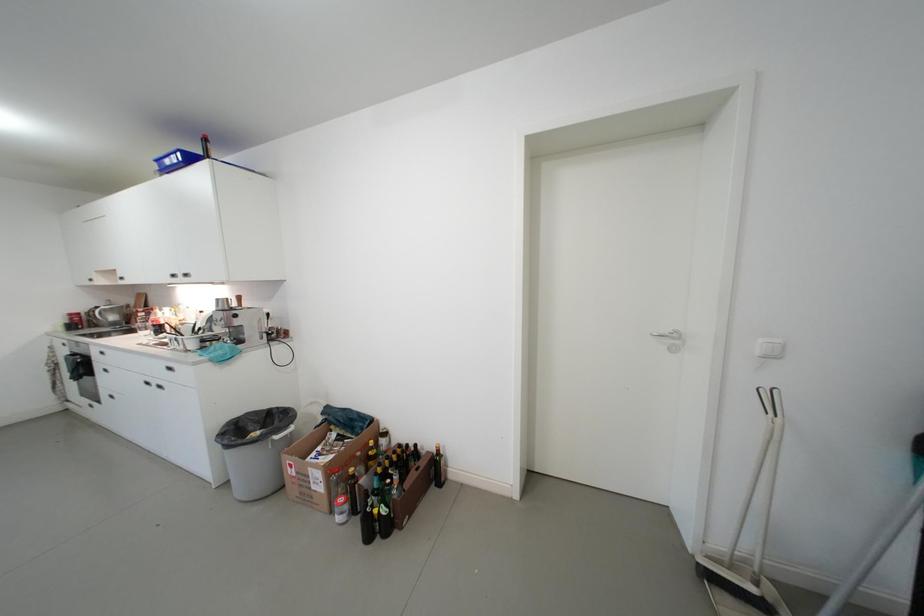
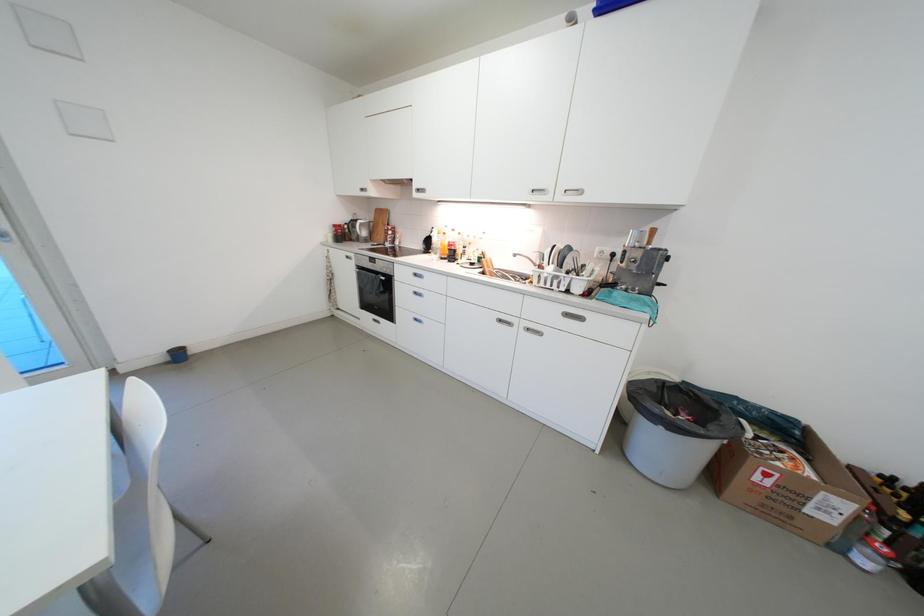
Question: What movement of the cameraman would produce the second image?

Choices:
 (A) Left
 (B) Right
 (C) Forward
 (D) Backward

Answer: (A)